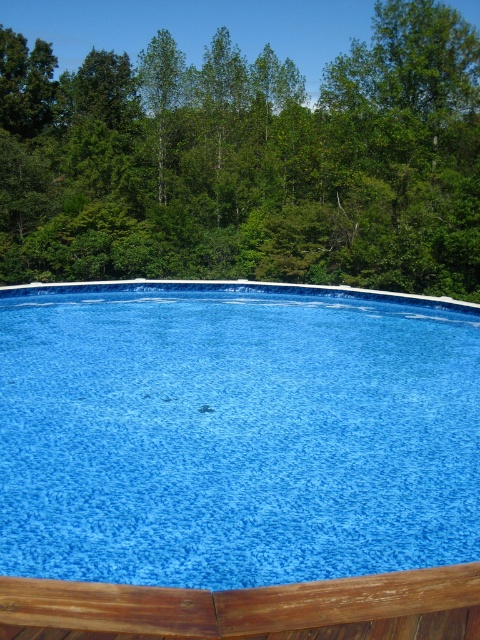
Who is positioned more to the left, blue textured pool at center or wooden deck at bottom?

Positioned to the left is blue textured pool at center.

Can you confirm if blue textured pool at center is positioned to the left of wooden deck at bottom?

Correct, you'll find blue textured pool at center to the left of wooden deck at bottom.

This screenshot has height=640, width=480. What do you see at coordinates (235, 433) in the screenshot?
I see `blue textured pool at center` at bounding box center [235, 433].

Where is `blue textured pool at center`? The width and height of the screenshot is (480, 640). blue textured pool at center is located at coordinates (235, 433).

Does green leafy tree at upper center appear over wooden deck at bottom?

Yes, green leafy tree at upper center is above wooden deck at bottom.

Between green leafy tree at upper center and wooden deck at bottom, which one is positioned higher?

green leafy tree at upper center is higher up.

The width and height of the screenshot is (480, 640). What are the coordinates of `green leafy tree at upper center` in the screenshot? It's located at (248, 161).

Identify the location of green leafy tree at upper center. The image size is (480, 640). (248, 161).

Is blue textured pool at center bigger than green leafy tree at upper center?

No.

Between blue textured pool at center and green leafy tree at upper center, which one is positioned higher?

green leafy tree at upper center

At what (x,y) coordinates should I click in order to perform the action: click on blue textured pool at center. Please return your answer as a coordinate pair (x, y). The width and height of the screenshot is (480, 640). Looking at the image, I should click on (235, 433).